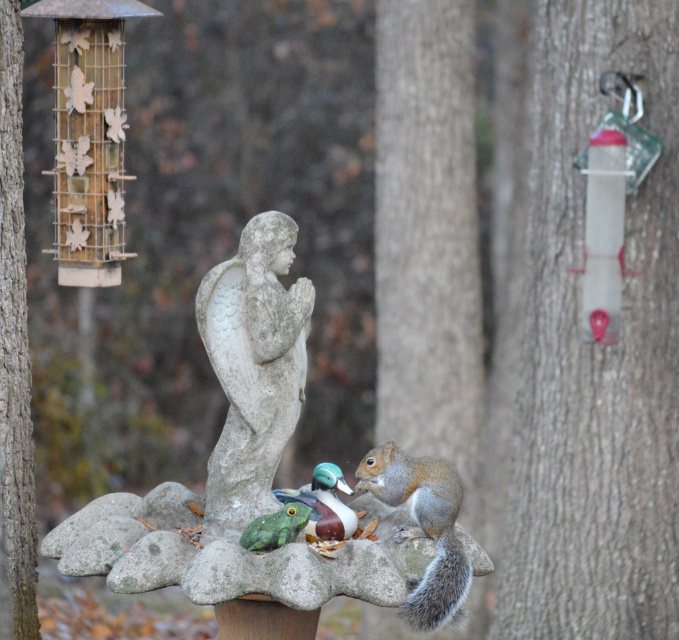
You are a photographer setting up a shot of the gray furry squirrel at lower right and the shiny green plastic duck at center. To ensure both are in frame, where should you position your camera relative to the duck?

The gray furry squirrel at lower right is to the right of the shiny green plastic duck at center, so you should position your camera to the right of the duck to include both in the frame.

You are standing in the garden and want to take a photo of the gray stone statue at center and the smooth brown bark at left. Which object will appear larger in the photo?

The gray stone statue at center will appear larger in the photo because it is closer to the camera than the smooth brown bark at left.